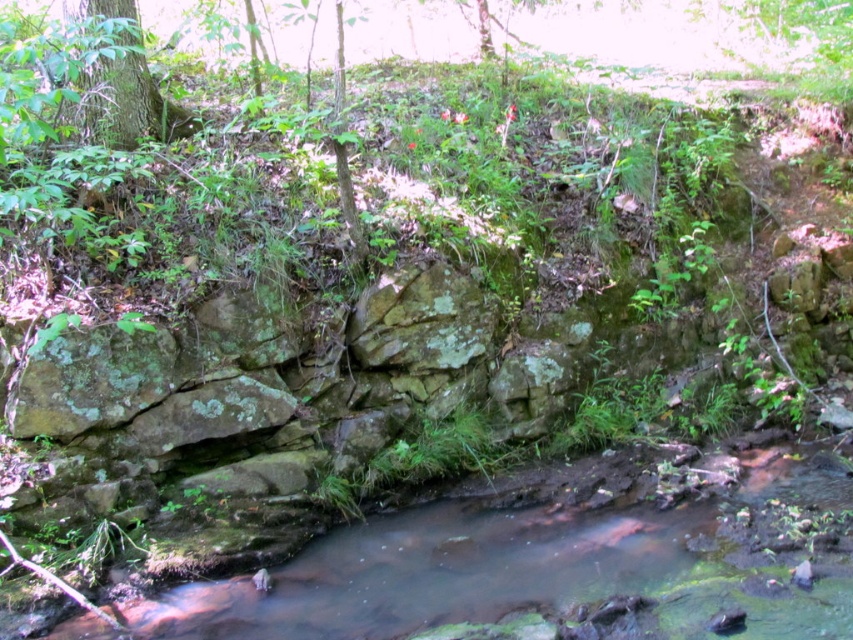
You are a hiker who wants to cross the stream using the green mossy tree at upper left as a guide. Since the clear water at center is lower than the tree, will you need to step into the water to reach the other side?

The clear water at center has a lesser height compared to green mossy tree at upper left, meaning the water is lower. Therefore, you would need to step into the water to cross the stream since the tree is higher up.

Consider the image. You are standing at the point with coordinates point (171, 118) and want to walk to the point with coordinates point (686, 602). Which direction should you move to get closer to your destination?

You should move forward because point (686, 602) is in front of point (171, 118).